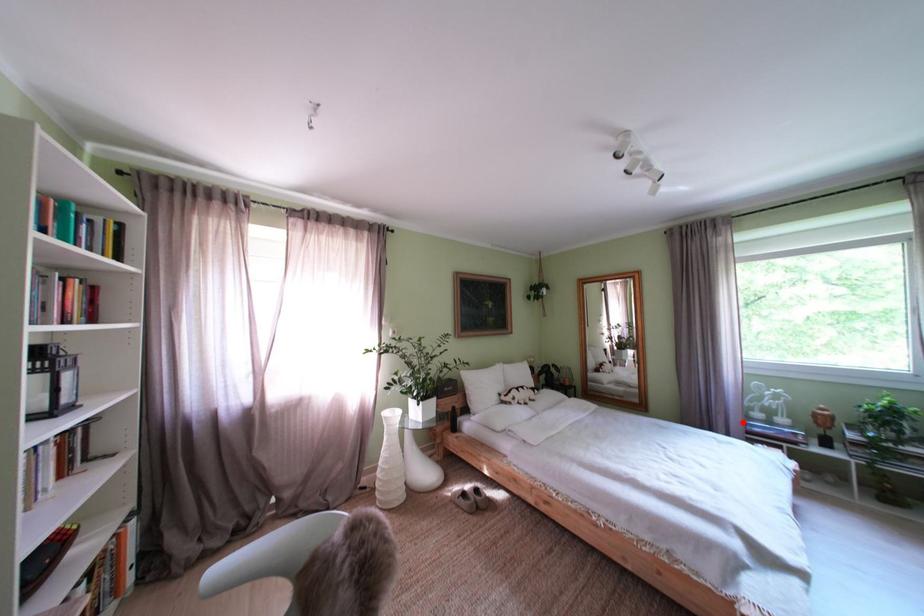
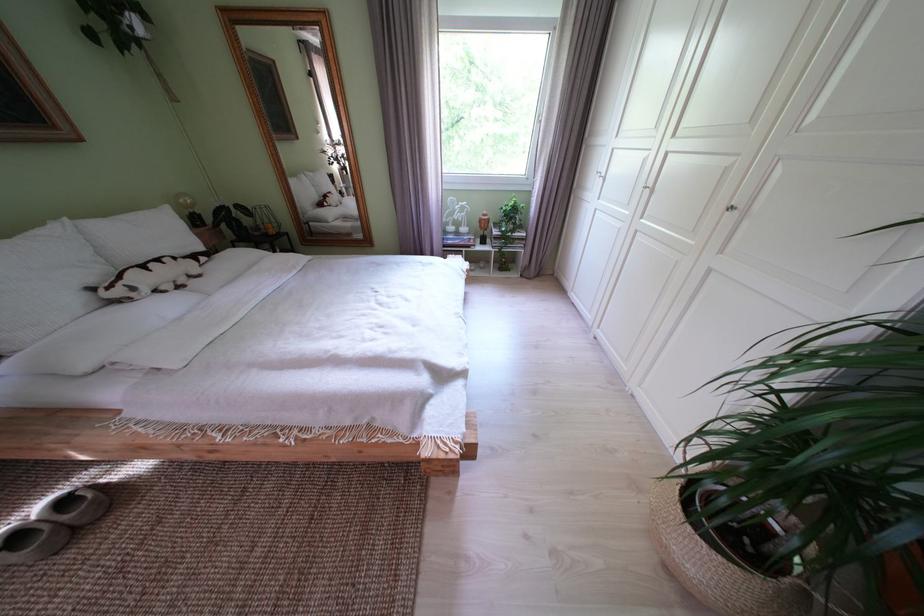
Question: I am providing you with two images of the same scene from different viewpoints. In image1, a red point is highlighted. Considering the same 3D point in image2, which of the following is correct?

Choices:
 (A) It is closer
 (B) It is farther

Answer: (A)